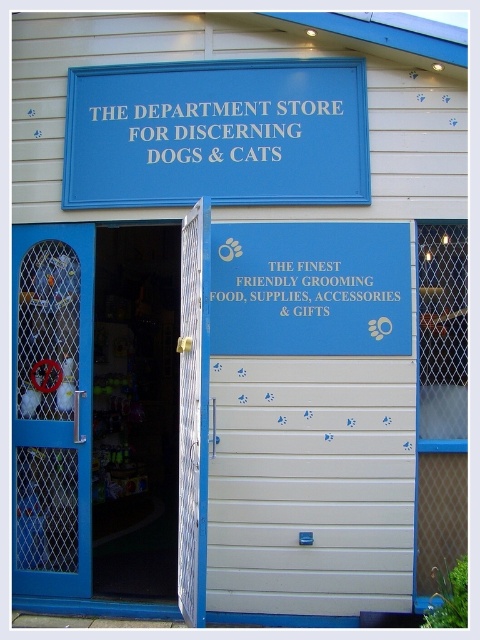
Question: Is beige/smooth garage door at center bigger than blue mesh door at left?

Choices:
 (A) no
 (B) yes

Answer: (B)

Question: Which of the following is the closest to the observer?

Choices:
 (A) blue matte sign at center
 (B) white mesh door at center

Answer: (B)

Question: Can you confirm if blue plastic sign at upper center is bigger than blue plastic sign at center?

Choices:
 (A) no
 (B) yes

Answer: (B)

Question: Is beige/smooth garage door at center positioned before white mesh door at center?

Choices:
 (A) no
 (B) yes

Answer: (A)

Question: Which point is farther to the camera?

Choices:
 (A) blue mesh door at left
 (B) white plastic sign at upper center

Answer: (B)

Question: Which object is the closest to the blue plastic sign at upper center?

Choices:
 (A) blue metal door at left
 (B) blue mesh door at left

Answer: (B)